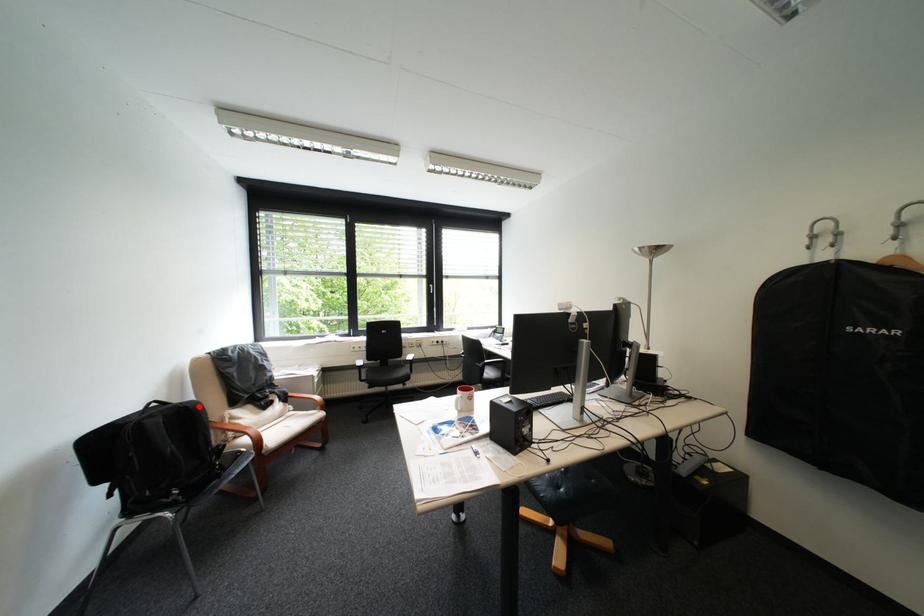
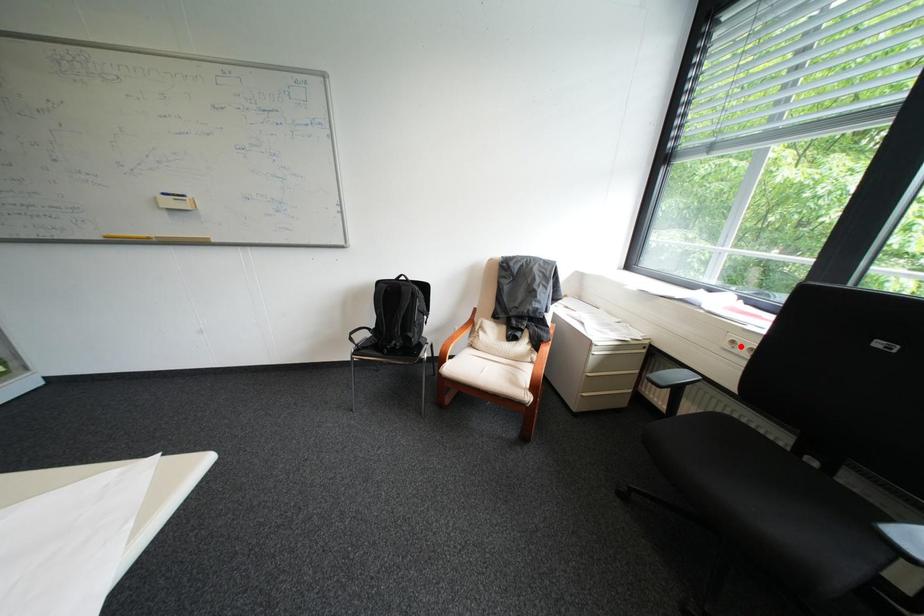
I am providing you with two images of the same scene from different viewpoints. A red point is marked on the first image and another point is marked on the second image. Does the point marked in image1 correspond to the same location as the one in image2?

No